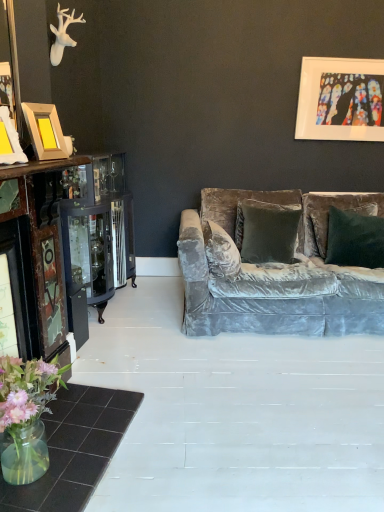
At what (x,y) coordinates should I click in order to perform the action: click on vacant space to the right of translucent glass vase at lower left. Please return your answer as a coordinate pair (x, y). Looking at the image, I should click on point(119,461).